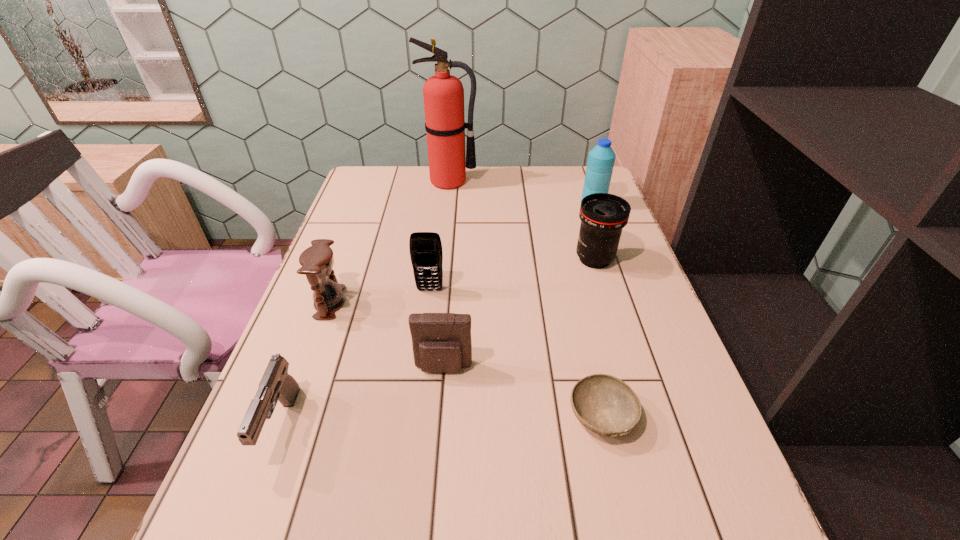
Image resolution: width=960 pixels, height=540 pixels. What are the coordinates of `free space at the far right corner of the desktop` in the screenshot? It's located at (575, 178).

Locate an element on the screen. This screenshot has height=540, width=960. free space between the cellular telephone and the hourglass is located at coordinates (380, 296).

At what (x,y) coordinates should I click in order to perform the action: click on empty location between the farthest object and the shortest object. Please return your answer as a coordinate pair (x, y). This screenshot has width=960, height=540. Looking at the image, I should click on (526, 299).

Locate an element on the screen. The image size is (960, 540). blank region between the hourglass and the water bottle is located at coordinates (462, 253).

This screenshot has width=960, height=540. I want to click on vacant area that lies between the seventh shortest object and the cellular telephone, so click(x=512, y=247).

Find the location of a particular element. free space between the fire extinguisher and the pistol is located at coordinates (366, 303).

At what (x,y) coordinates should I click in order to perform the action: click on vacant space that is in between the third farthest object and the fire extinguisher. Please return your answer as a coordinate pair (x, y). The image size is (960, 540). Looking at the image, I should click on (522, 220).

Locate an element on the screen. This screenshot has height=540, width=960. unoccupied area between the tallest object and the hourglass is located at coordinates (390, 242).

Locate which object ranks seventh in proximity to the shortest object. Please provide its 2D coordinates. Your answer should be formatted as a tuple, i.e. [(x, y)], where the tuple contains the x and y coordinates of a point satisfying the conditions above.

[(443, 94)]

Point out which object is positioned as the fourth nearest to the cellular telephone. Please provide its 2D coordinates. Your answer should be formatted as a tuple, i.e. [(x, y)], where the tuple contains the x and y coordinates of a point satisfying the conditions above.

[(603, 216)]